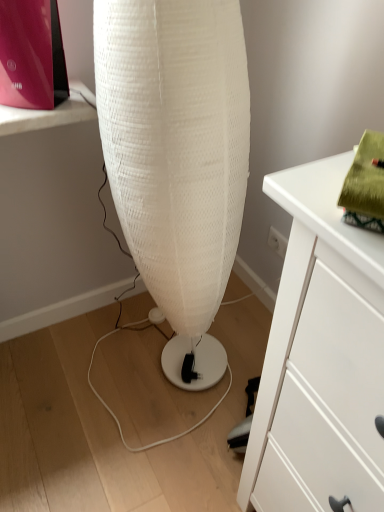
The image size is (384, 512). What are the coordinates of `free space in front of white mesh lamp at center` in the screenshot? It's located at (150, 444).